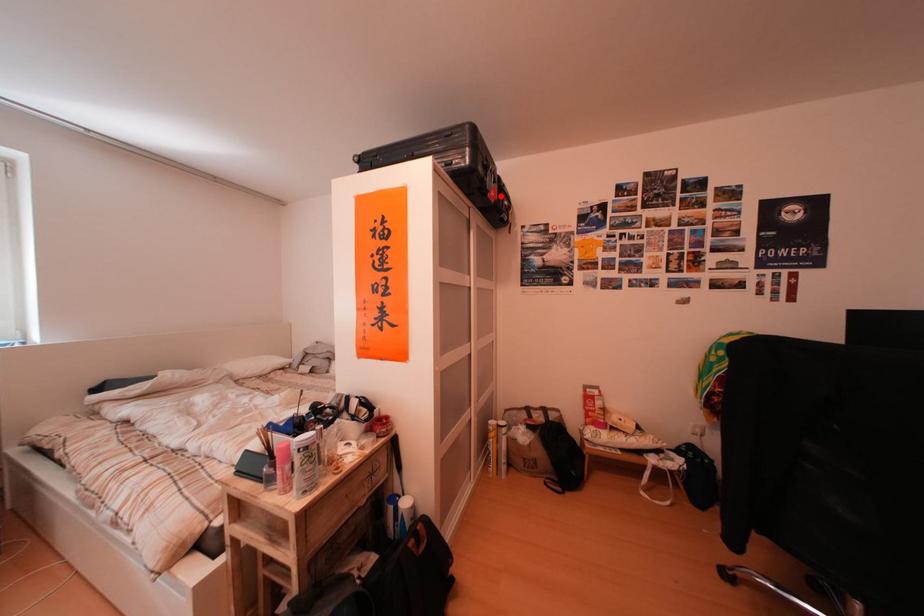
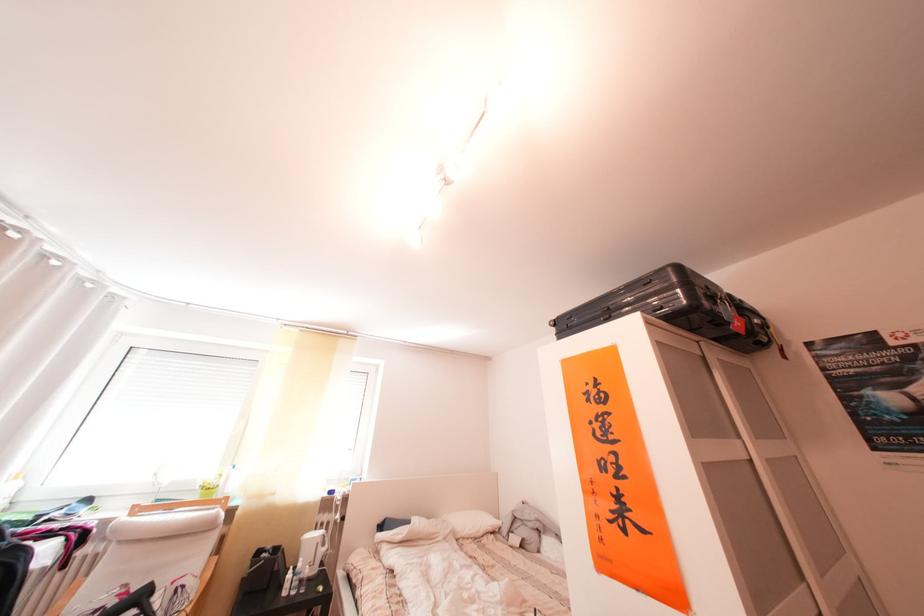
Question: I am providing you with two images of the same scene from different viewpoints. A red point is marked on the first image. Can you still see the location of the red point in image 2?

Choices:
 (A) Yes
 (B) No

Answer: (A)